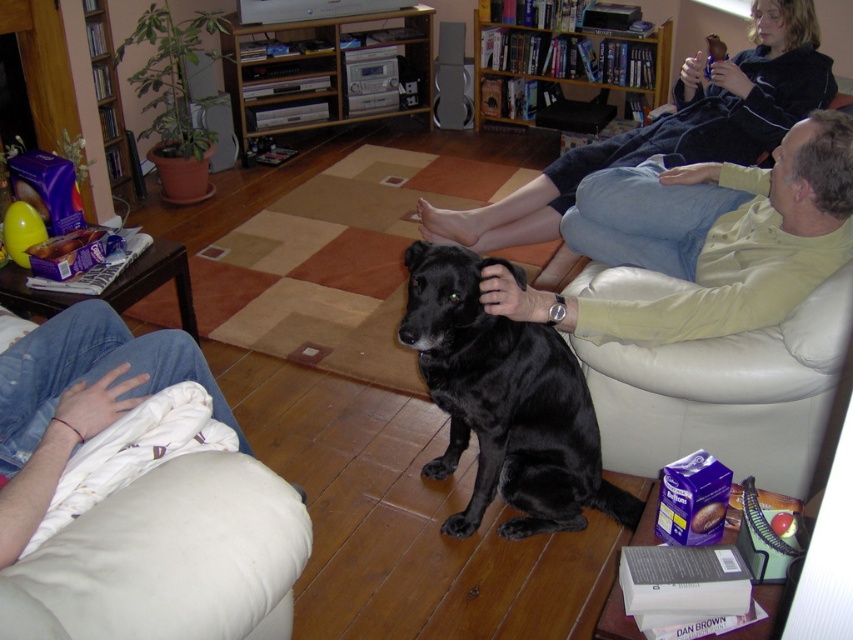
Is point (804, 134) in front of point (636, 148)?

Yes, it is.

Can you confirm if matte yellow shirt at center is positioned above black fur dog at center?

Actually, matte yellow shirt at center is below black fur dog at center.

Where is `matte yellow shirt at center`? matte yellow shirt at center is located at coordinates (708, 240).

Where is `matte yellow shirt at center`? matte yellow shirt at center is located at coordinates (708, 240).

Which is above, black shiny dog at center or black fur dog at center?

Positioned higher is black fur dog at center.

Does black shiny dog at center have a greater height compared to black fur dog at center?

No, black shiny dog at center is not taller than black fur dog at center.

Which is behind, point (450, 444) or point (728, 90)?

Point (728, 90)

At what (x,y) coordinates should I click in order to perform the action: click on black shiny dog at center. Please return your answer as a coordinate pair (x, y). Looking at the image, I should click on (505, 401).

Is matte yellow shirt at center shorter than black shiny dog at center?

Yes, matte yellow shirt at center is shorter than black shiny dog at center.

From the picture: Who is higher up, matte yellow shirt at center or black shiny dog at center?

matte yellow shirt at center is above.

The width and height of the screenshot is (853, 640). What do you see at coordinates (708, 240) in the screenshot? I see `matte yellow shirt at center` at bounding box center [708, 240].

At what (x,y) coordinates should I click in order to perform the action: click on matte yellow shirt at center. Please return your answer as a coordinate pair (x, y). This screenshot has height=640, width=853. Looking at the image, I should click on (708, 240).